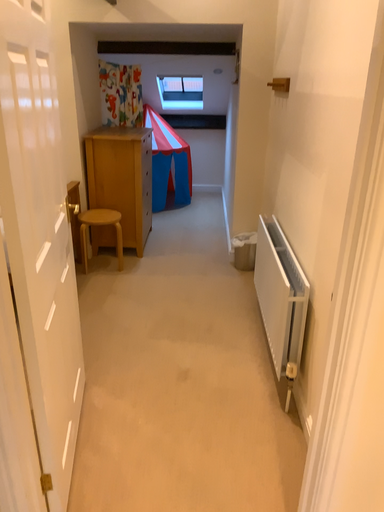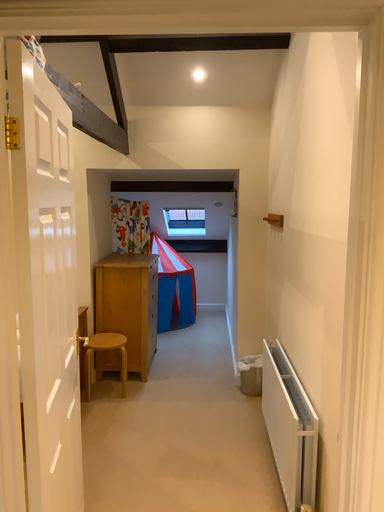
Question: How did the camera likely rotate when shooting the video?

Choices:
 (A) rotated upward
 (B) rotated downward

Answer: (A)